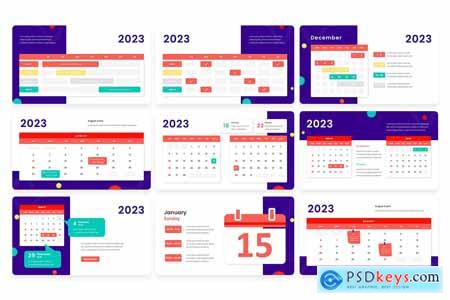
Where is `calendars with various information on them`? The height and width of the screenshot is (300, 450). calendars with various information on them is located at coordinates click(x=91, y=79), click(x=205, y=78), click(x=358, y=77), click(x=210, y=243).